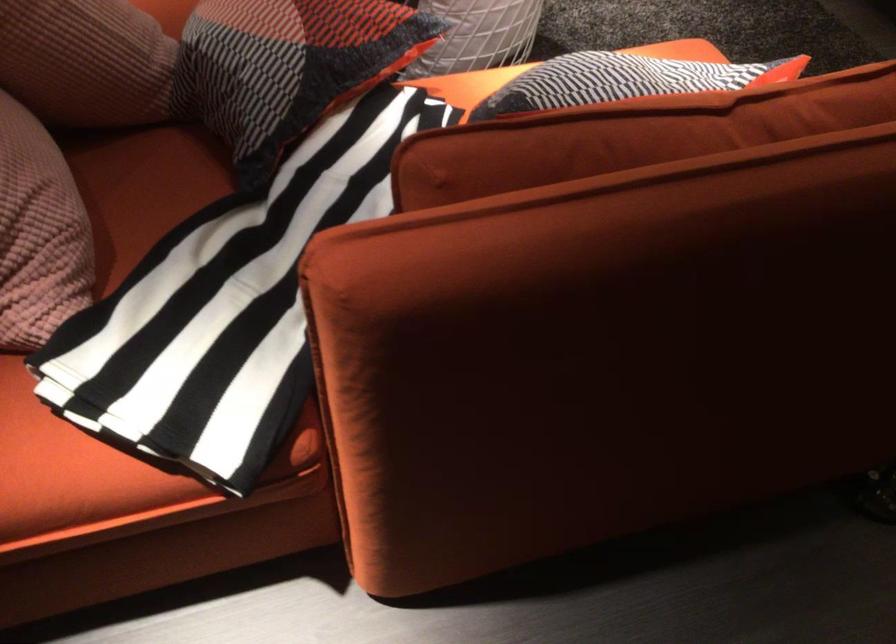
Where is `white wire basket`? Image resolution: width=896 pixels, height=644 pixels. white wire basket is located at coordinates (478, 35).